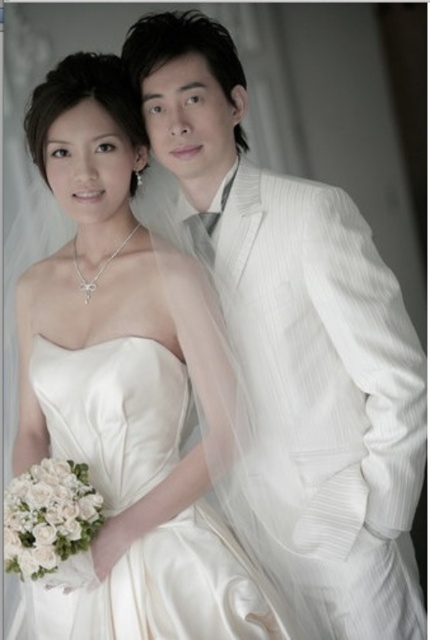
Question: Among these objects, which one is farthest from the camera?

Choices:
 (A) white pinstripe suit at center
 (B) satin dress at center

Answer: (A)

Question: Does white pinstripe suit at center come in front of satin dress at center?

Choices:
 (A) yes
 (B) no

Answer: (B)

Question: Does white pinstripe suit at center lie in front of satin dress at center?

Choices:
 (A) yes
 (B) no

Answer: (B)

Question: Is white pinstripe suit at center below satin dress at center?

Choices:
 (A) yes
 (B) no

Answer: (B)

Question: Which point appears closest to the camera in this image?

Choices:
 (A) (157, 74)
 (B) (156, 522)

Answer: (B)